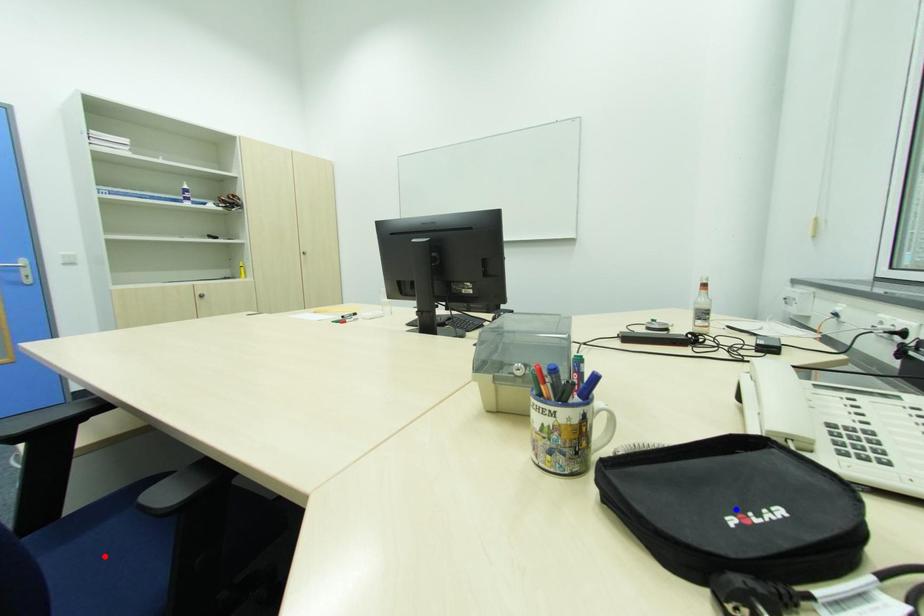
Question: In the image, two points are highlighted. Which point is nearer to the camera? Reply with the corresponding letter.

Choices:
 (A) blue point
 (B) red point

Answer: (A)